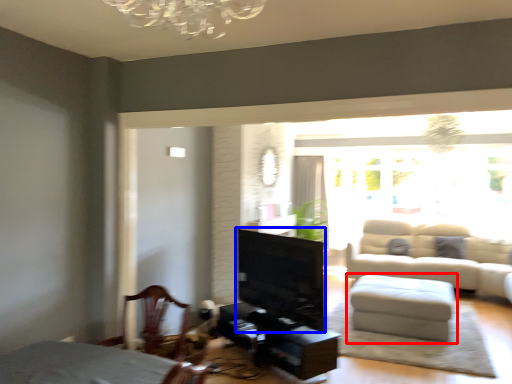
Question: Among these objects, which one is nearest to the camera, table (highlighted by a red box) or fireplace (highlighted by a blue box)?

Choices:
 (A) table
 (B) fireplace

Answer: (B)